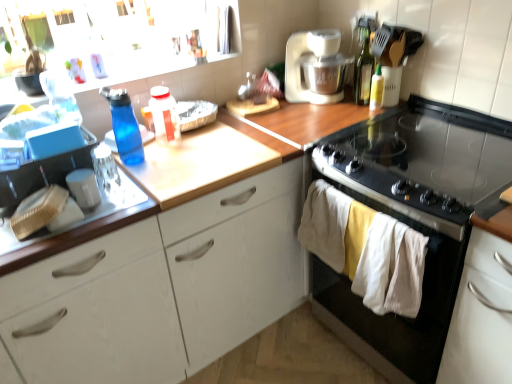
Where is `free spot in front of green glass bottle at upper right, the 3th bottle in the left-to-right sequence`? Image resolution: width=512 pixels, height=384 pixels. free spot in front of green glass bottle at upper right, the 3th bottle in the left-to-right sequence is located at coordinates (361, 116).